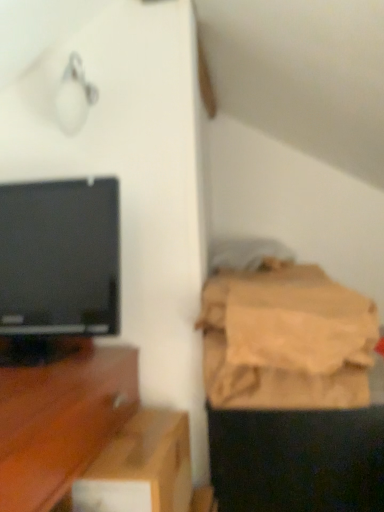
Question: Considering the relative positions of brown cardboard box at lower center and brown fabric bag at right in the image provided, is brown cardboard box at lower center to the left of brown fabric bag at right from the viewer's perspective?

Choices:
 (A) no
 (B) yes

Answer: (B)

Question: Is brown cardboard box at lower center bigger than brown fabric bag at right?

Choices:
 (A) yes
 (B) no

Answer: (B)

Question: Does brown cardboard box at lower center have a greater height compared to brown fabric bag at right?

Choices:
 (A) no
 (B) yes

Answer: (A)

Question: From the image's perspective, is brown cardboard box at lower center on brown fabric bag at right?

Choices:
 (A) yes
 (B) no

Answer: (B)

Question: Is brown cardboard box at lower center beside brown fabric bag at right?

Choices:
 (A) no
 (B) yes

Answer: (A)

Question: Is brown cardboard box at lower center smaller than brown fabric bag at right?

Choices:
 (A) yes
 (B) no

Answer: (A)

Question: From a real-world perspective, does wooden tv stand at left sit lower than black glossy television at left?

Choices:
 (A) no
 (B) yes

Answer: (B)

Question: Is wooden tv stand at left in front of black glossy television at left?

Choices:
 (A) yes
 (B) no

Answer: (A)

Question: Does wooden tv stand at left appear on the right side of black glossy television at left?

Choices:
 (A) no
 (B) yes

Answer: (A)

Question: Is wooden tv stand at left not near black glossy television at left?

Choices:
 (A) no
 (B) yes

Answer: (A)

Question: Is black glossy television at left surrounded by wooden tv stand at left?

Choices:
 (A) yes
 (B) no

Answer: (B)

Question: From the image's perspective, is wooden tv stand at left on top of black glossy television at left?

Choices:
 (A) no
 (B) yes

Answer: (A)

Question: Could you tell me if black glossy television at left is turned towards wooden tv stand at left?

Choices:
 (A) yes
 (B) no

Answer: (B)